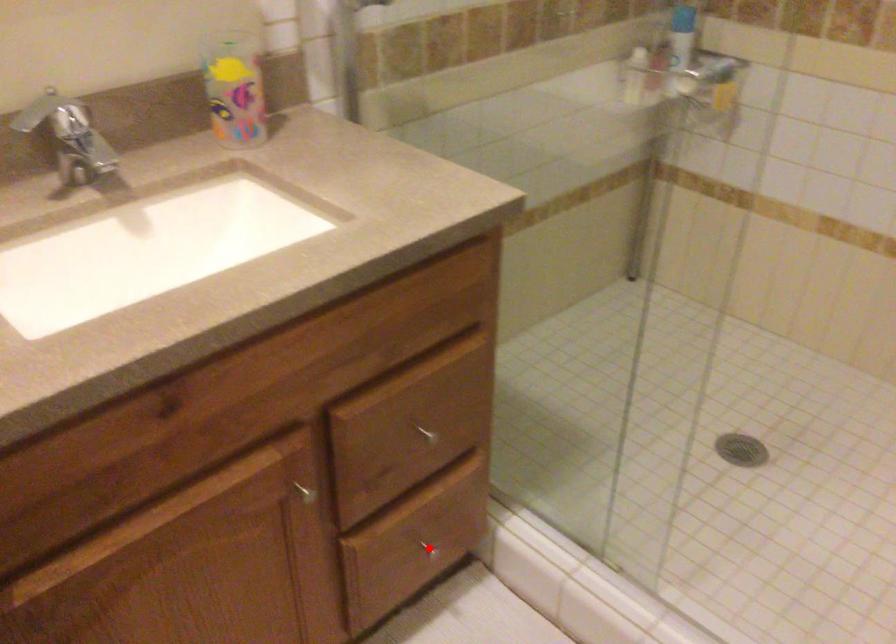
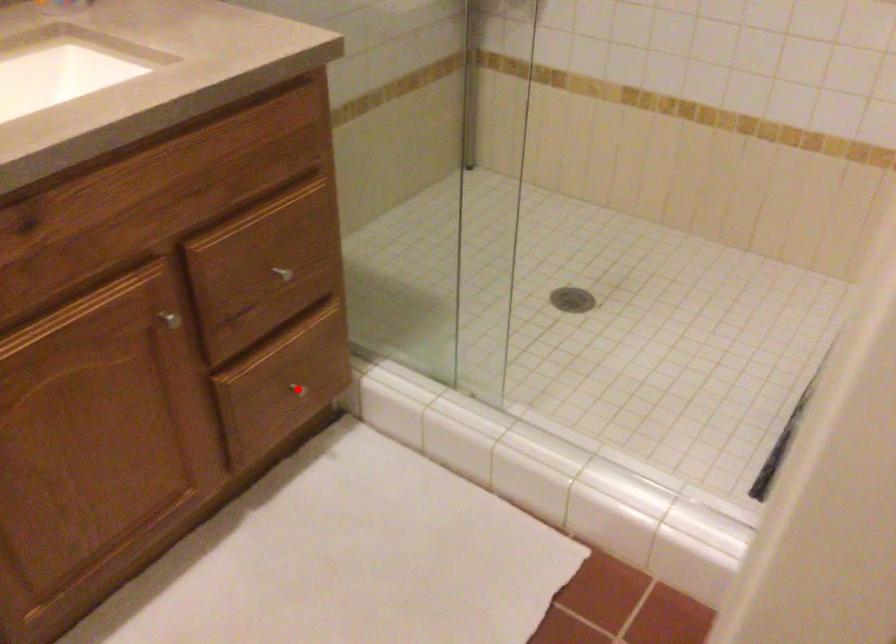
I am providing you with two images of the same scene from different viewpoints. A red point is marked on the first image and another point is marked on the second image. Do the highlighted points in image1 and image2 indicate the same real-world spot?

Yes